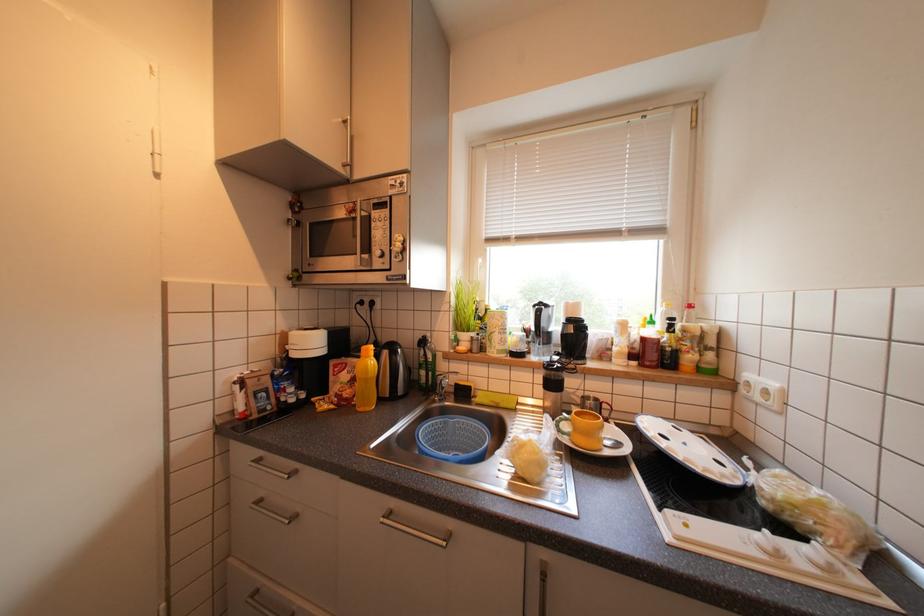
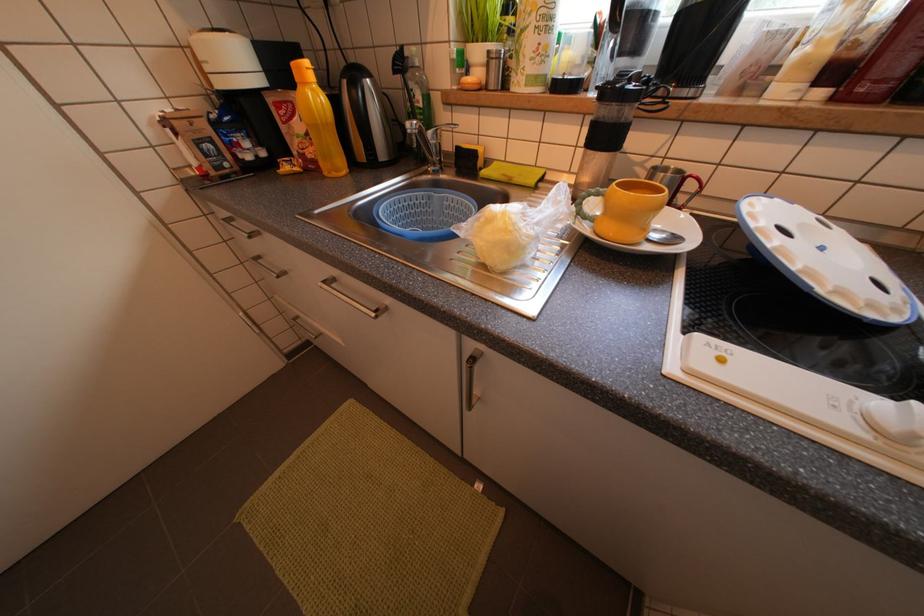
Based on the continuous images, in which direction is the camera rotating?

The camera rotated toward left-down.